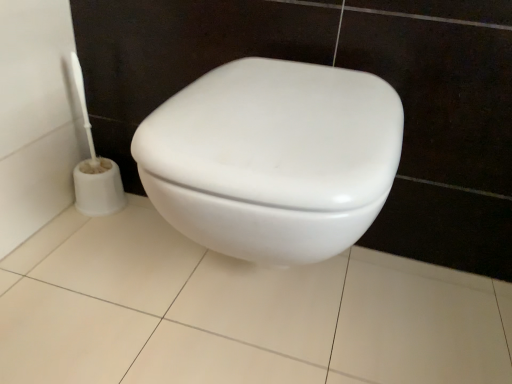
Where is `blank space to the left of white glossy toilet at center`? The width and height of the screenshot is (512, 384). blank space to the left of white glossy toilet at center is located at coordinates (104, 278).